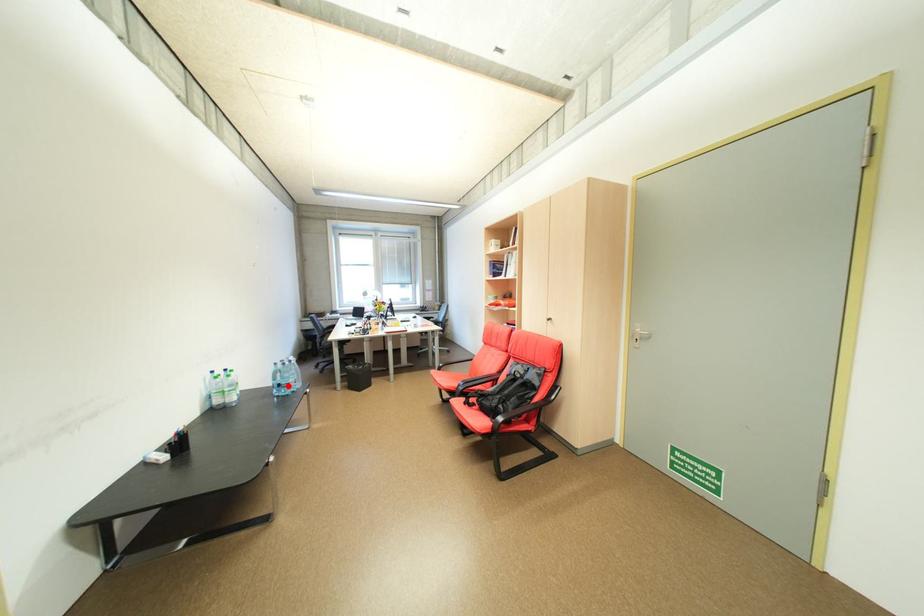
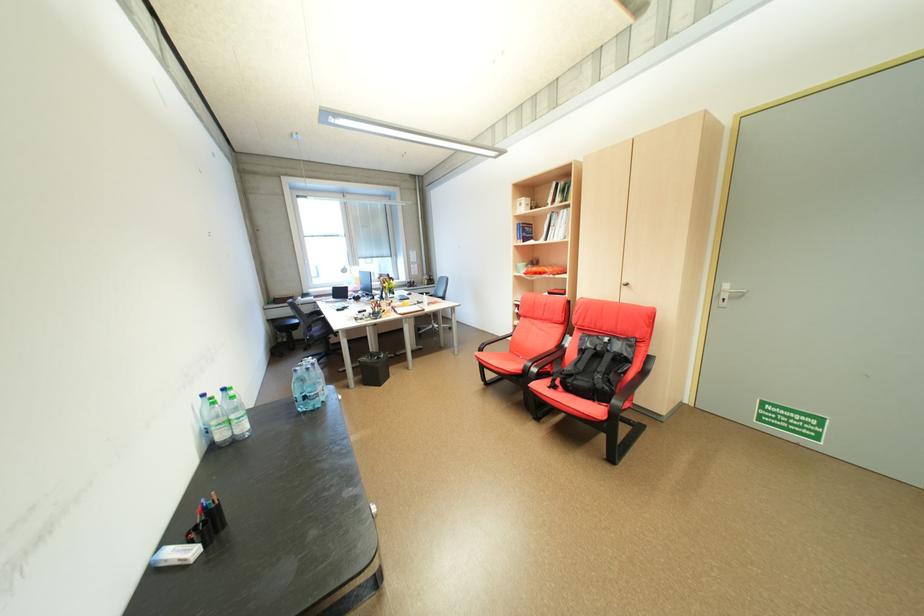
Find the pixel in the second image that matches the highlighted location in the first image.

(313, 398)